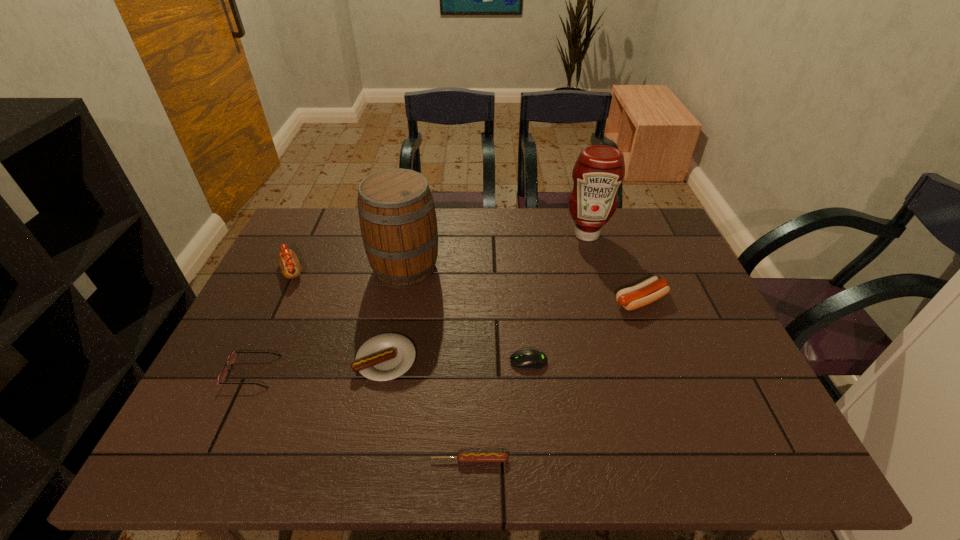
This screenshot has height=540, width=960. Identify the location of vacant space at the right edge. (677, 312).

Locate an element on the screen. The width and height of the screenshot is (960, 540). vacant space in between the condiment and the sixth object from left to right is located at coordinates (558, 298).

You are a GUI agent. You are given a task and a screenshot of the screen. Output one action in this format:
    pyautogui.click(x=<x>, y=<y>)
    Task: Click on the free space between the third tallest sausage and the farthest object
    The height and width of the screenshot is (540, 960).
    Given the screenshot: What is the action you would take?
    pyautogui.click(x=487, y=297)

In order to click on free spot between the nearest sausage and the second nearest sausage in this screenshot , I will do `click(428, 409)`.

Identify the location of vacant area that lies between the second shortest object and the farthest object. The height and width of the screenshot is (540, 960). (558, 298).

Where is `blank region between the cider and the farthest object`? This screenshot has height=540, width=960. blank region between the cider and the farthest object is located at coordinates (496, 251).

In order to click on free spot between the second shortest object and the condiment in this screenshot , I will do `click(558, 298)`.

This screenshot has height=540, width=960. I want to click on vacant region between the cider and the second shortest sausage, so click(396, 314).

The image size is (960, 540). Find the location of `free area in between the nearest sausage and the sunglasses`. free area in between the nearest sausage and the sunglasses is located at coordinates (361, 416).

Locate which object ranks second in proximity to the farthest sausage. Please provide its 2D coordinates. Your answer should be formatted as a tuple, i.e. [(x, y)], where the tuple contains the x and y coordinates of a point satisfying the conditions above.

[(232, 358)]